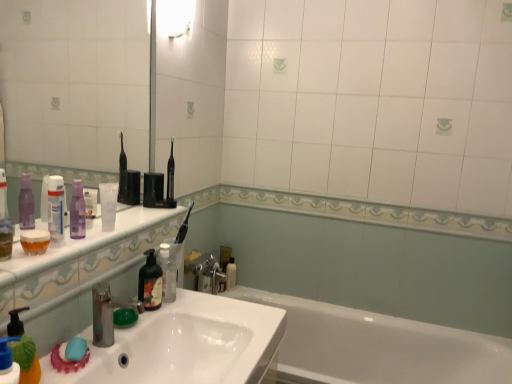
Question: Is purple matte bottle at left, which is counted as the third toiletry, starting from the back, behind purple matte lotion at upper left, acting as the second toiletry starting from the back?

Choices:
 (A) no
 (B) yes

Answer: (A)

Question: Can we say purple matte bottle at left, acting as the 1th toiletry starting from the top, lies outside purple matte lotion at upper left, placed as the third toiletry when sorted from top to bottom?

Choices:
 (A) yes
 (B) no

Answer: (A)

Question: Can you confirm if purple matte bottle at left, which is counted as the third toiletry, starting from the back, is wider than purple matte lotion at upper left, acting as the second toiletry starting from the back?

Choices:
 (A) no
 (B) yes

Answer: (B)

Question: Is purple matte lotion at upper left, the second toiletry positioned from the bottom, surrounded by purple matte bottle at left, acting as the 1th toiletry starting from the top?

Choices:
 (A) yes
 (B) no

Answer: (B)

Question: Is purple matte bottle at left, the fourth toiletry positioned from the bottom, turned away from purple matte lotion at upper left, the second toiletry from the left?

Choices:
 (A) no
 (B) yes

Answer: (A)

Question: Is point (231, 266) closer or farther from the camera than point (495, 344)?

Choices:
 (A) farther
 (B) closer

Answer: (A)

Question: From a real-world perspective, is white glossy bottle at lower center, the fourth toiletry from the top, above or below white glossy bathtub at lower right?

Choices:
 (A) below
 (B) above

Answer: (B)

Question: In terms of width, does white glossy bottle at lower center, which appears as the fourth toiletry when viewed from the left, look wider or thinner when compared to white glossy bathtub at lower right?

Choices:
 (A) wide
 (B) thin

Answer: (B)

Question: In the image, is white glossy bottle at lower center, the first toiletry positioned from the bottom, positioned in front of or behind white glossy bathtub at lower right?

Choices:
 (A) front
 (B) behind

Answer: (B)

Question: Is white glossy bottle at lower center, positioned as the first toiletry in back-to-front order, bigger or smaller than white glossy sink at lower left?

Choices:
 (A) small
 (B) big

Answer: (A)

Question: Based on their positions, is white glossy bottle at lower center, which appears as the fourth toiletry when viewed from the left, located to the left or right of white glossy sink at lower left?

Choices:
 (A) left
 (B) right

Answer: (B)

Question: Is white glossy bottle at lower center, which is counted as the 4th toiletry, starting from the front, taller or shorter than white glossy sink at lower left?

Choices:
 (A) tall
 (B) short

Answer: (A)

Question: In the image, is white glossy bottle at lower center, the first toiletry positioned from the bottom, positioned in front of or behind white glossy sink at lower left?

Choices:
 (A) behind
 (B) front

Answer: (A)

Question: From a real-world perspective, is blue matte pump bottle at lower left positioned above or below white glossy tube at upper left, which ranks as the second toiletry in top-to-bottom order?

Choices:
 (A) below
 (B) above

Answer: (A)

Question: In terms of size, does blue matte pump bottle at lower left appear bigger or smaller than white glossy tube at upper left, which is counted as the first toiletry, starting from the front?

Choices:
 (A) small
 (B) big

Answer: (B)